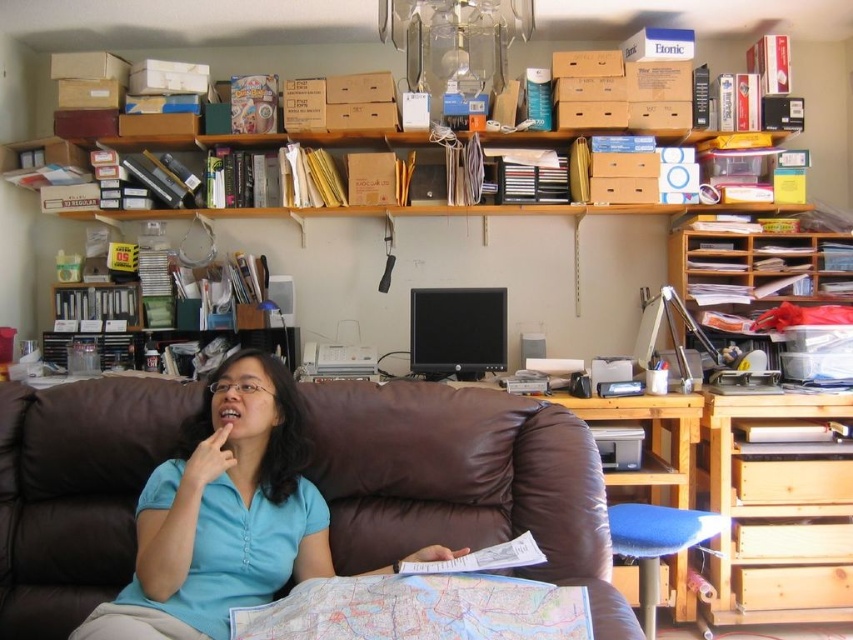
Question: From the image, what is the correct spatial relationship of blue cotton shirt at center in relation to wooden desk at right?

Choices:
 (A) right
 (B) left

Answer: (B)

Question: Does blue cotton shirt at center appear on the right side of wooden desk at right?

Choices:
 (A) no
 (B) yes

Answer: (A)

Question: Among these points, which one is nearest to the camera?

Choices:
 (A) (231, 540)
 (B) (813, 292)

Answer: (A)

Question: Can you confirm if blue cotton shirt at center is smaller than wooden desk at right?

Choices:
 (A) yes
 (B) no

Answer: (B)

Question: Which point is farther from the camera taking this photo?

Choices:
 (A) (178, 464)
 (B) (814, 285)

Answer: (B)